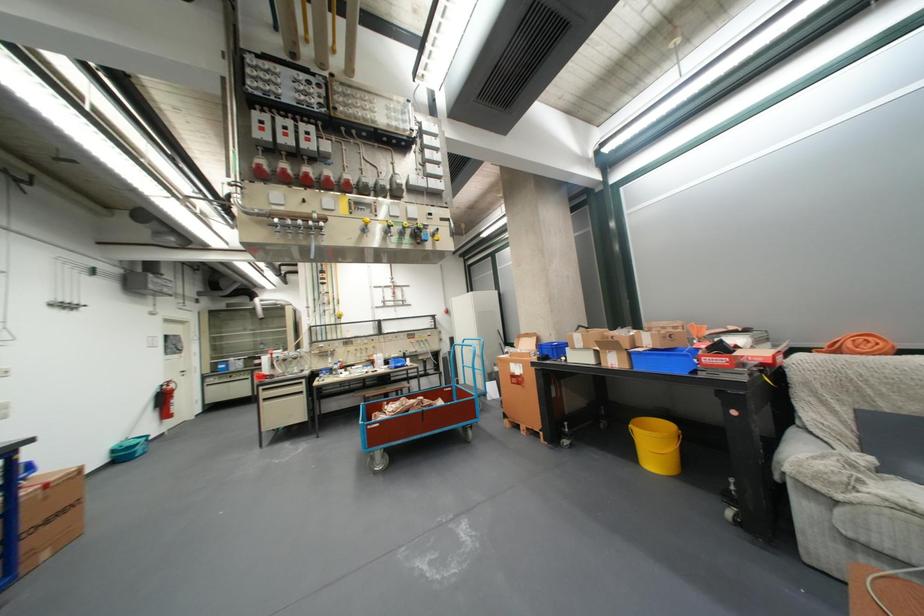
In order to click on yellow bucket in this screenshot , I will do `click(657, 445)`.